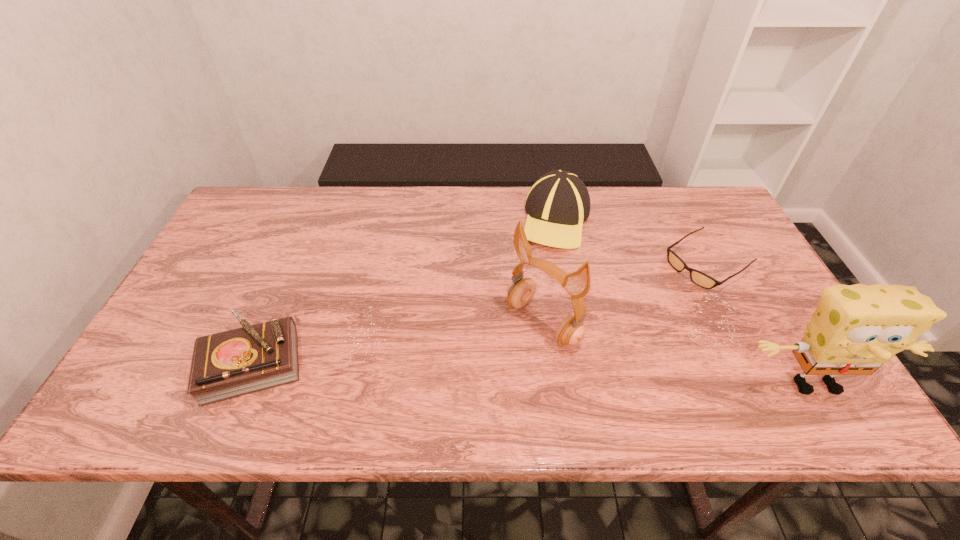
The image size is (960, 540). In order to click on object identified as the closest to the diary in this screenshot , I will do `click(571, 331)`.

I want to click on vacant space that satisfies the following two spatial constraints: 1. on the front side of the sunglasses; 2. on the right side of the third tallest object, so click(x=564, y=262).

Locate an element on the screen. The height and width of the screenshot is (540, 960). vacant space that satisfies the following two spatial constraints: 1. on the back side of the second shortest object; 2. on the right side of the third shortest object is located at coordinates (312, 220).

This screenshot has width=960, height=540. What are the coordinates of `free location that satisfies the following two spatial constraints: 1. on the back side of the sunglasses; 2. on the right side of the earphone` in the screenshot? It's located at (535, 262).

Find the location of `free space that satisfies the following two spatial constraints: 1. on the back side of the earphone; 2. on the right side of the leftmost object`. free space that satisfies the following two spatial constraints: 1. on the back side of the earphone; 2. on the right side of the leftmost object is located at coordinates (269, 323).